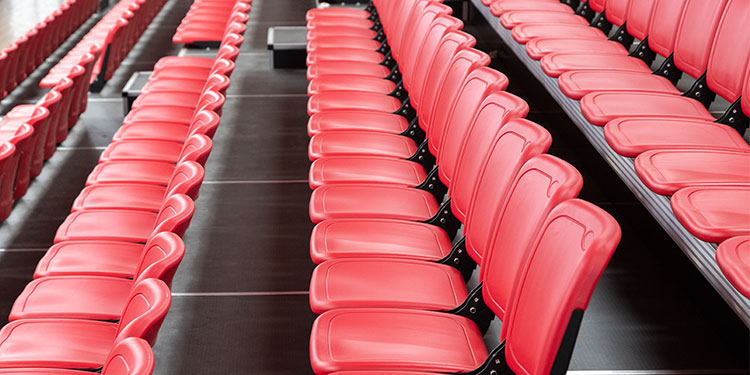
Where is `top row back part of cushion`? top row back part of cushion is located at coordinates (746, 102), (730, 77), (687, 44), (660, 31), (636, 17), (613, 13), (590, 8).